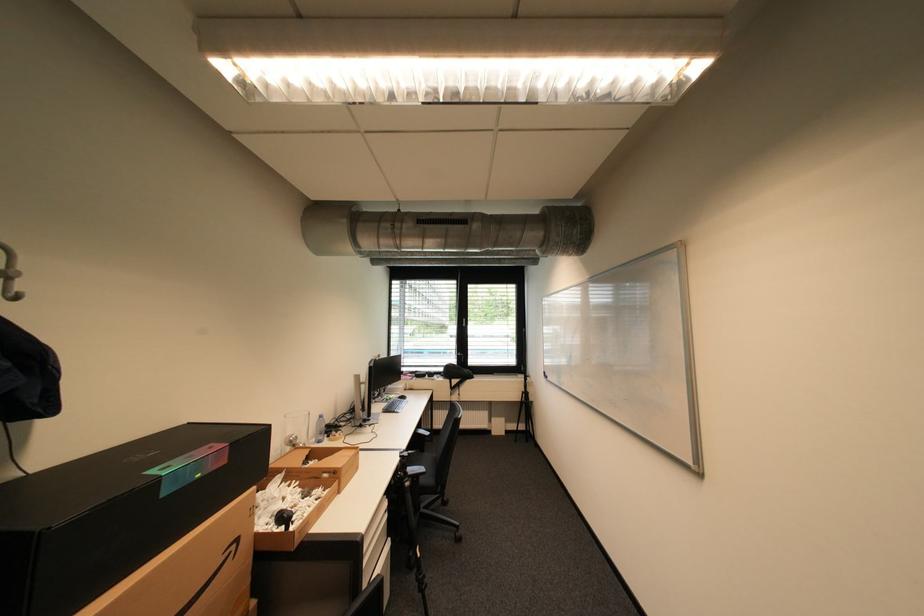
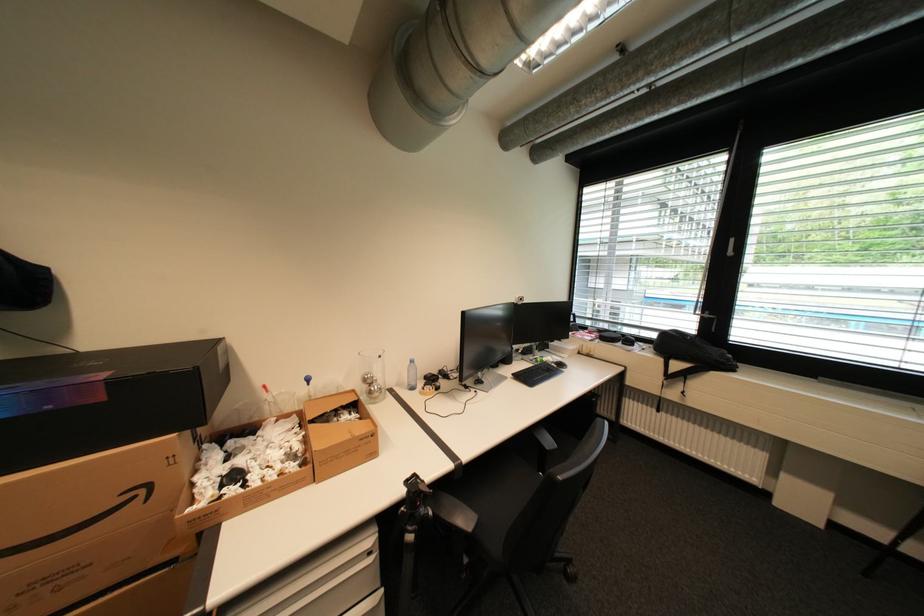
The point at (460, 389) is marked in the first image. Where is the corresponding point in the second image?

(678, 377)